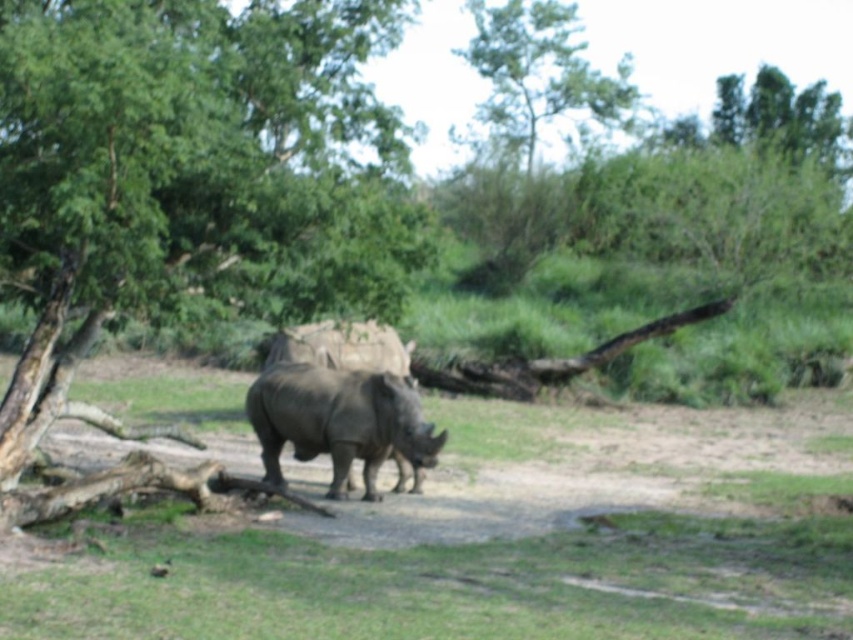
You are a safari guide observing the scene. You notice the green leafy tree at center and the gray matte rhinoceros at center. Which object is positioned more to the left side of the image?

The green leafy tree at center is positioned more to the left side of the image compared to the gray matte rhinoceros at center.

You are a photographer aiming to capture a clear shot of the gray matte rhinoceros at center. However, the green leafy tree at center is blocking your view. Can you adjust your position to avoid the obstruction?

The green leafy tree at center is in front of the gray matte rhinoceros at center, so moving your position to the side or behind the tree might allow you to see around it and capture the rhinoceros without obstruction.